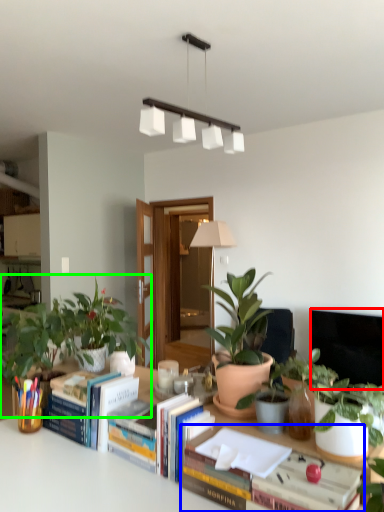
Question: Based on their relative distances, which object is nearer to television (highlighted by a red box)? Choose from book (highlighted by a blue box) and houseplant (highlighted by a green box).

Choices:
 (A) book
 (B) houseplant

Answer: (B)